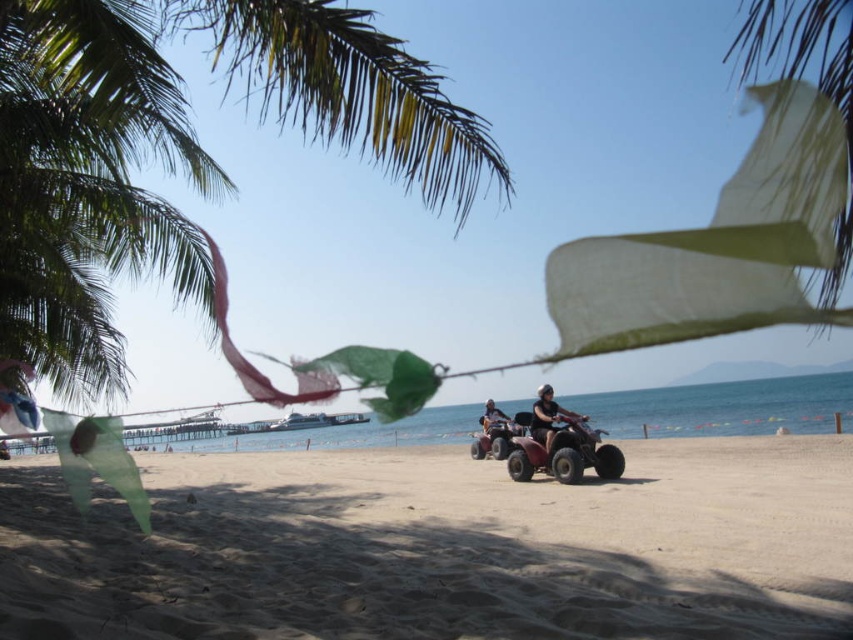
You are standing on the sandy beach at lower center and want to shade yourself using the green leafy palm tree at upper left. Can you stand directly under the palm tree to get shade?

The sandy beach at lower center is positioned under the green leafy palm tree at upper left, so yes, you can stand directly under the palm tree to get shade.

You are standing on the sandy beach at lower center and want to see the metallic silver quad bike at center. Is the quad bike visible from your current position?

The sandy beach at lower center is much taller than the metallic silver quad bike at center, so the quad bike may be partially or fully obscured from your viewpoint depending on the elevation difference. However, since the scene describes the quad bike as being in the midground with trails in the sand, it is likely visible despite the height difference.

You are standing on the sandy beach at lower center and want to reach the metallic silver quad bike at center. Which direction should you move to get there?

You should move to the right because the sandy beach at lower center is positioned on the left side of the metallic silver quad bike at center.